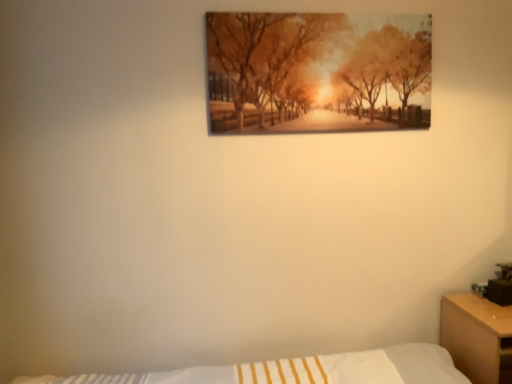
Consider the image. What is the approximate height of wooden nightstand at right?

It is 20.80 inches.

Measure the distance between point (x=509, y=334) and camera.

A distance of 1.69 meters exists between point (x=509, y=334) and camera.

The width and height of the screenshot is (512, 384). Describe the element at coordinates (317, 72) in the screenshot. I see `matte wooden picture frame at upper center` at that location.

Where is `wooden nightstand at right`? This screenshot has width=512, height=384. wooden nightstand at right is located at coordinates (477, 337).

Is matte wooden picture frame at upper center not inside matte black table lamp at right?

Indeed, matte wooden picture frame at upper center is completely outside matte black table lamp at right.

Is matte wooden picture frame at upper center positioned behind matte black table lamp at right?

No, matte wooden picture frame at upper center is closer to the camera.

Consider the image. Considering the relative sizes of matte wooden picture frame at upper center and matte black table lamp at right in the image provided, is matte wooden picture frame at upper center shorter than matte black table lamp at right?

No, matte wooden picture frame at upper center is not shorter than matte black table lamp at right.

At what (x,y) coordinates should I click in order to perform the action: click on table lamp that appears above the wooden nightstand at right (from a real-world perspective). Please return your answer as a coordinate pair (x, y). Image resolution: width=512 pixels, height=384 pixels. Looking at the image, I should click on (501, 286).

Considering the relative positions of matte black table lamp at right and wooden nightstand at right in the image provided, is matte black table lamp at right to the right of wooden nightstand at right from the viewer's perspective?

Correct, you'll find matte black table lamp at right to the right of wooden nightstand at right.

Is point (490, 291) positioned behind point (470, 373)?

Yes, point (490, 291) is farther from viewer.

Is matte black table lamp at right wider or thinner than wooden nightstand at right?

Considering their sizes, matte black table lamp at right looks slimmer than wooden nightstand at right.

Who is bigger, matte black table lamp at right or matte wooden picture frame at upper center?

matte wooden picture frame at upper center is bigger.

Measure the distance from matte black table lamp at right to matte wooden picture frame at upper center.

matte black table lamp at right is 3.97 feet away from matte wooden picture frame at upper center.

Can you confirm if matte black table lamp at right is taller than matte wooden picture frame at upper center?

No, matte black table lamp at right is not taller than matte wooden picture frame at upper center.

I want to click on table lamp that is behind the matte wooden picture frame at upper center, so click(x=501, y=286).

Considering the relative sizes of wooden nightstand at right and matte wooden picture frame at upper center in the image provided, is wooden nightstand at right bigger than matte wooden picture frame at upper center?

Indeed, wooden nightstand at right has a larger size compared to matte wooden picture frame at upper center.

Considering the sizes of objects wooden nightstand at right and matte wooden picture frame at upper center in the image provided, who is shorter, wooden nightstand at right or matte wooden picture frame at upper center?

wooden nightstand at right is shorter.

Is matte wooden picture frame at upper center a part of wooden nightstand at right?

No, matte wooden picture frame at upper center is not a part of wooden nightstand at right.

Considering the sizes of objects matte wooden picture frame at upper center and wooden nightstand at right in the image provided, who is thinner, matte wooden picture frame at upper center or wooden nightstand at right?

With smaller width is matte wooden picture frame at upper center.

Does matte wooden picture frame at upper center appear on the right side of wooden nightstand at right?

In fact, matte wooden picture frame at upper center is to the left of wooden nightstand at right.

Looking at this image, is matte wooden picture frame at upper center oriented towards wooden nightstand at right?

No.

Where is `nightstand that is below the matte wooden picture frame at upper center (from the image's perspective)`? The width and height of the screenshot is (512, 384). nightstand that is below the matte wooden picture frame at upper center (from the image's perspective) is located at coordinates (477, 337).

Image resolution: width=512 pixels, height=384 pixels. I want to click on table lamp lying behind the wooden nightstand at right, so click(x=501, y=286).

Is wooden nightstand at right touching matte black table lamp at right?

No.

Between wooden nightstand at right and matte black table lamp at right, which one appears on the left side from the viewer's perspective?

wooden nightstand at right.

From a real-world perspective, is wooden nightstand at right on top of matte black table lamp at right?

No, from a real-world perspective, wooden nightstand at right is not above matte black table lamp at right.

Locate an element on the screen. picture frame that is above the matte black table lamp at right (from a real-world perspective) is located at coordinates (317, 72).

You are a GUI agent. You are given a task and a screenshot of the screen. Output one action in this format:
    pyautogui.click(x=<x>, y=<y>)
    Task: Click on the nightstand directly beneath the matte black table lamp at right (from a real-world perspective)
    The image size is (512, 384).
    Given the screenshot: What is the action you would take?
    pyautogui.click(x=477, y=337)

Consider the image. Based on their spatial positions, is matte wooden picture frame at upper center or matte black table lamp at right closer to wooden nightstand at right?

matte black table lamp at right.

When comparing their distances from matte wooden picture frame at upper center, does wooden nightstand at right or matte black table lamp at right seem closer?

Among the two, wooden nightstand at right is located nearer to matte wooden picture frame at upper center.

Based on the photo, estimate the real-world distances between objects in this image. Which object is further from matte black table lamp at right, wooden nightstand at right or matte wooden picture frame at upper center?

matte wooden picture frame at upper center is positioned further to the anchor matte black table lamp at right.

Looking at this image, considering their positions, is matte black table lamp at right positioned further to matte wooden picture frame at upper center than wooden nightstand at right?

The object further to matte wooden picture frame at upper center is matte black table lamp at right.

Which object lies nearer to the anchor point matte black table lamp at right, matte wooden picture frame at upper center or wooden nightstand at right?

wooden nightstand at right is closer to matte black table lamp at right.

Considering their positions, is matte black table lamp at right positioned closer to wooden nightstand at right than matte wooden picture frame at upper center?

matte black table lamp at right lies closer to wooden nightstand at right than the other object.

Where is `table lamp between matte wooden picture frame at upper center and wooden nightstand at right in the vertical direction`? This screenshot has height=384, width=512. table lamp between matte wooden picture frame at upper center and wooden nightstand at right in the vertical direction is located at coordinates (501, 286).